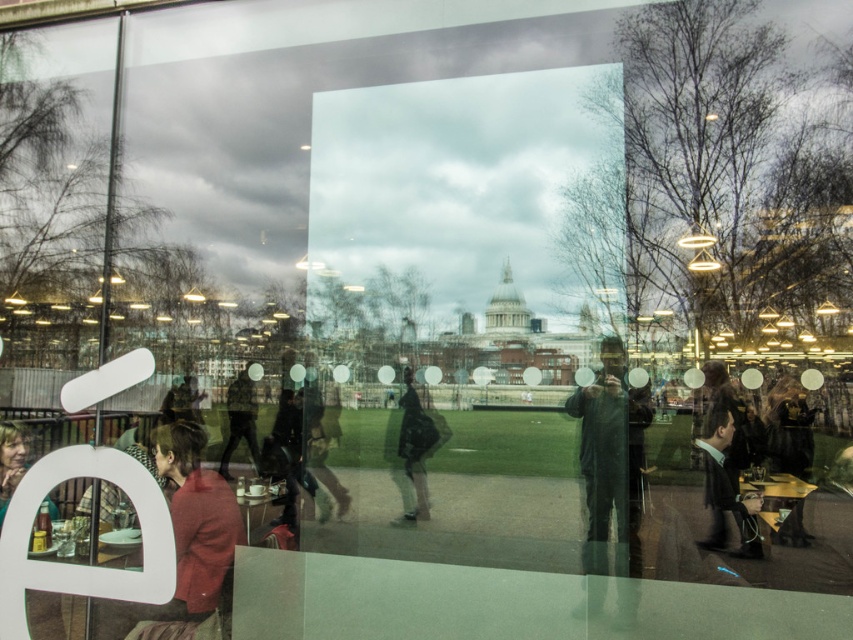
You are standing inside the cafe and looking through the reflective window. There is a point on the window at coordinates [820,534]. What object is located at that point on the window?

At point [820,534] lies green fabric jacket at lower right.

You are a customer trying to find a seat in the outdoor area visible through the window. You notice two people, one wearing a dark suit at right and another in a matte black jacket at lower left. Which person is wearing a wider garment?

The matte black jacket at lower left is wider than the dark suit at right.